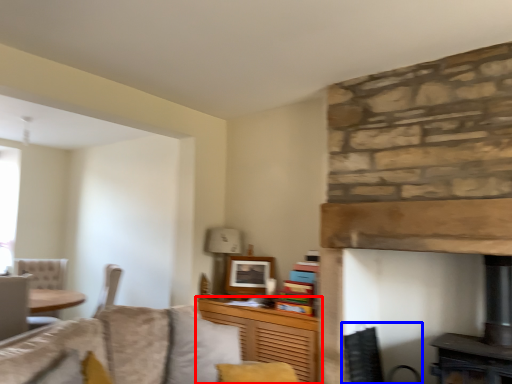
Question: Which object is closer to the camera taking this photo, cabinetry (highlighted by a red box) or swivel chair (highlighted by a blue box)?

Choices:
 (A) cabinetry
 (B) swivel chair

Answer: (A)